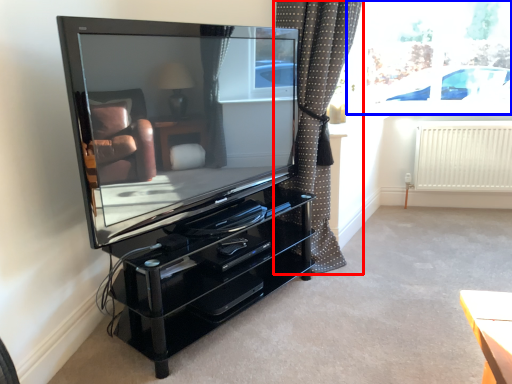
Question: Which point is closer to the camera, curtain (highlighted by a red box) or window screen (highlighted by a blue box)?

Choices:
 (A) curtain
 (B) window screen

Answer: (A)